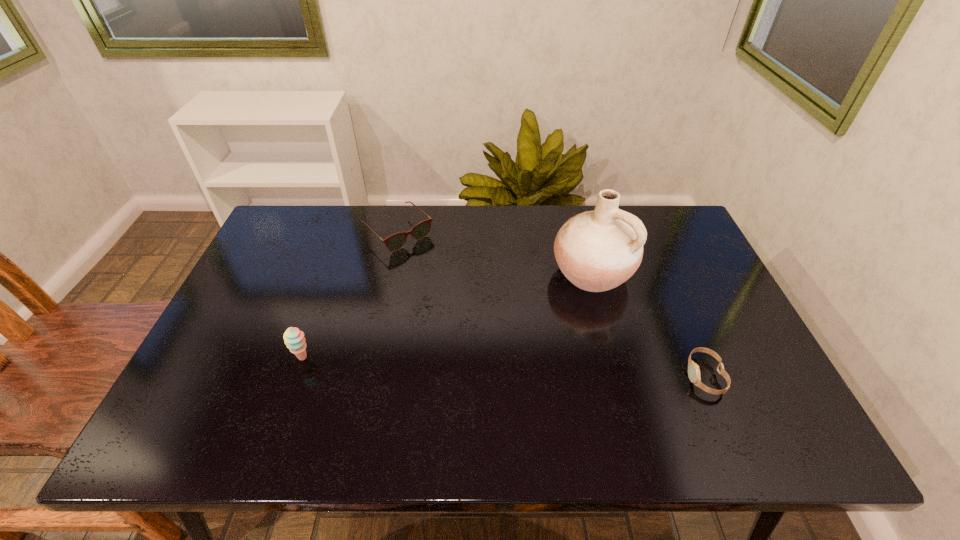
Where is `object located in the near edge section of the desktop`? The height and width of the screenshot is (540, 960). object located in the near edge section of the desktop is located at coordinates (693, 369).

Where is `object that is at the right edge`? The width and height of the screenshot is (960, 540). object that is at the right edge is located at coordinates (693, 369).

What are the coordinates of `object situated at the near right corner` in the screenshot? It's located at (693, 369).

Find the location of a particular element. vacant point at the far edge is located at coordinates (388, 233).

I want to click on free region at the near edge of the desktop, so click(x=667, y=395).

Locate an element on the screen. vacant space at the left edge of the desktop is located at coordinates (223, 337).

Identify the location of blank space at the right edge. (721, 299).

Image resolution: width=960 pixels, height=540 pixels. In the image, there is a desktop. In order to click on free space at the far left corner in this screenshot , I will do `click(323, 208)`.

In the image, there is a desktop. Where is `vacant space at the far right corner`? The width and height of the screenshot is (960, 540). vacant space at the far right corner is located at coordinates (680, 239).

Locate an element on the screen. The image size is (960, 540). unoccupied position between the third object from left to right and the rightmost object is located at coordinates (648, 325).